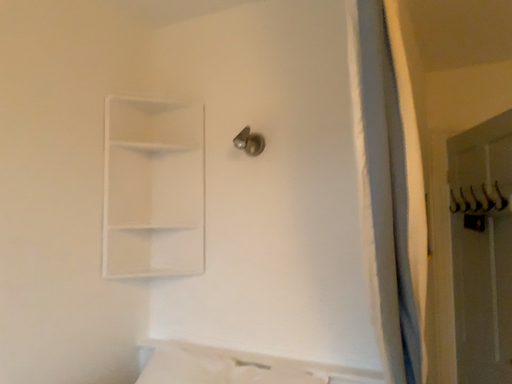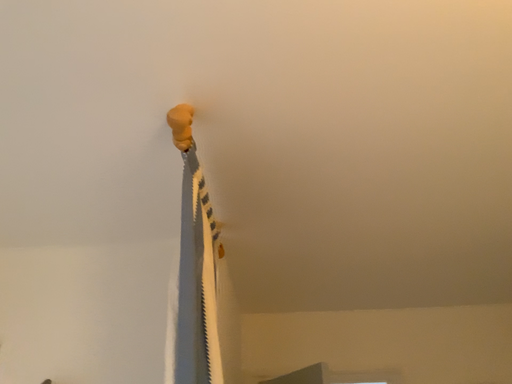
Question: Which way did the camera rotate in the video?

Choices:
 (A) rotated right
 (B) rotated left

Answer: (A)